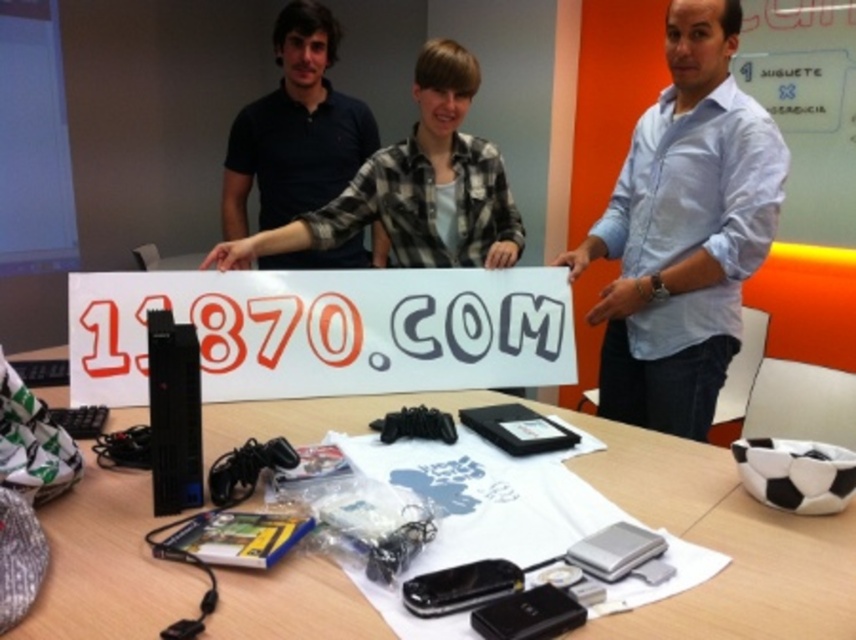
Question: Considering the real-world distances, which object is closest to the light blue shirt at center?

Choices:
 (A) white paper sign at center
 (B) plaid shirt at center

Answer: (A)

Question: In this image, where is wooden table at center located relative to white paper sign at center?

Choices:
 (A) above
 (B) below

Answer: (B)

Question: Among these objects, which one is nearest to the camera?

Choices:
 (A) wooden table at center
 (B) dark blue polo shirt at upper left

Answer: (A)

Question: In this image, where is wooden table at center located relative to white paper sign at center?

Choices:
 (A) below
 (B) above

Answer: (A)

Question: Which point appears farthest from the camera in this image?

Choices:
 (A) (663, 209)
 (B) (218, 600)
 (C) (456, 90)
 (D) (306, 120)

Answer: (D)

Question: Observing the image, what is the correct spatial positioning of plaid shirt at center in reference to dark blue polo shirt at upper left?

Choices:
 (A) above
 (B) below

Answer: (B)